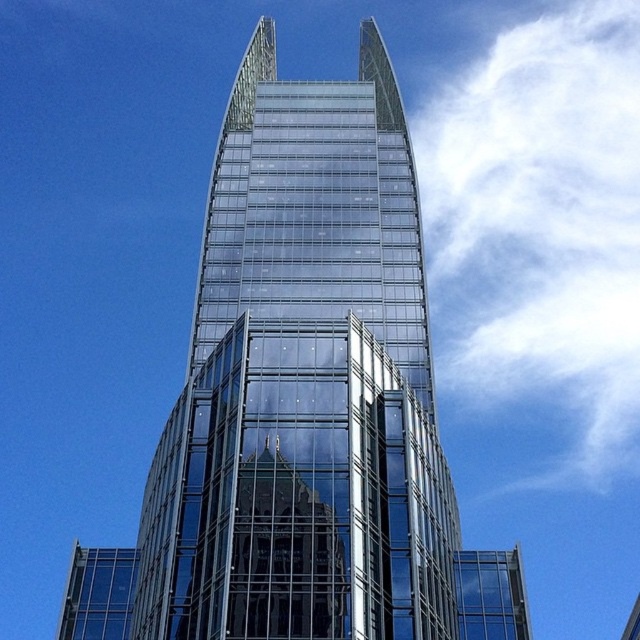
Question: Which object appears farthest from the camera in this image?

Choices:
 (A) white fluffy cloud at upper right
 (B) transparent glass tower at center

Answer: (A)

Question: Is transparent glass tower at center closer to camera compared to white fluffy cloud at upper right?

Choices:
 (A) yes
 (B) no

Answer: (A)

Question: Which object is farther from the camera taking this photo?

Choices:
 (A) white fluffy cloud at upper right
 (B) transparent glass tower at center

Answer: (A)

Question: Does transparent glass tower at center lie in front of white fluffy cloud at upper right?

Choices:
 (A) no
 (B) yes

Answer: (B)

Question: Among these points, which one is farthest from the camera?

Choices:
 (A) 259,474
 (B) 582,140

Answer: (B)

Question: Is transparent glass tower at center behind white fluffy cloud at upper right?

Choices:
 (A) yes
 (B) no

Answer: (B)